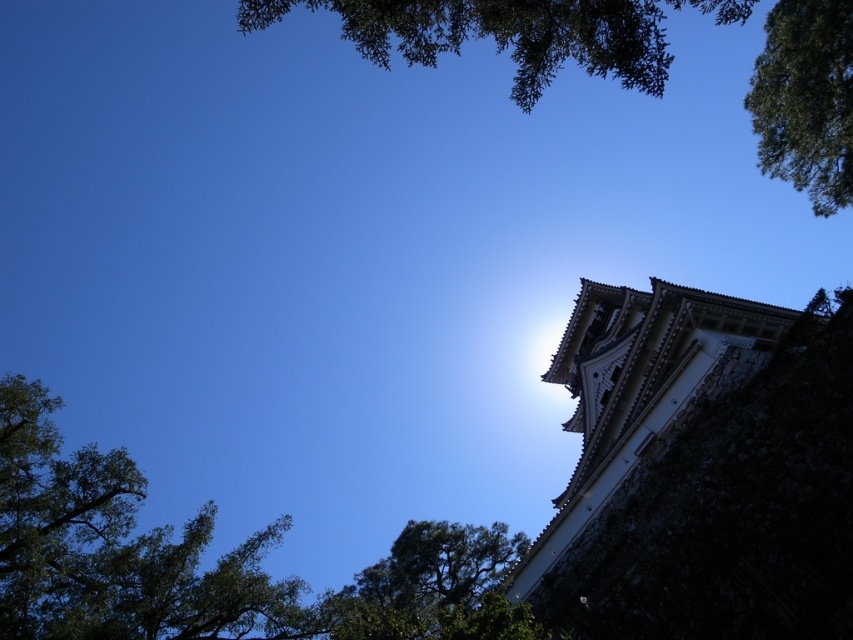
Can you confirm if green leafy tree at lower left is positioned to the left of green leafy tree at upper right?

Yes, green leafy tree at lower left is to the left of green leafy tree at upper right.

Is green leafy tree at lower left wider than green leafy tree at upper right?

Indeed, green leafy tree at lower left has a greater width compared to green leafy tree at upper right.

The height and width of the screenshot is (640, 853). What are the coordinates of `green leafy tree at lower left` in the screenshot? It's located at (117, 548).

Is green leafy tree at lower left in front of green leafy tree at upper center?

No.

Consider the image. Which of these two, green leafy tree at lower left or green leafy tree at upper center, stands taller?

With more height is green leafy tree at upper center.

Identify the location of green leafy tree at lower left. (117, 548).

This screenshot has height=640, width=853. I want to click on green leafy tree at lower left, so click(x=117, y=548).

The width and height of the screenshot is (853, 640). I want to click on white stone tower at upper right, so click(700, 468).

In the scene shown: Can you confirm if white stone tower at upper right is positioned above green leafy tree at upper right?

No, white stone tower at upper right is not above green leafy tree at upper right.

Is point (695, 477) closer to camera compared to point (751, 86)?

Yes, point (695, 477) is in front of point (751, 86).

Image resolution: width=853 pixels, height=640 pixels. Identify the location of white stone tower at upper right. (700, 468).